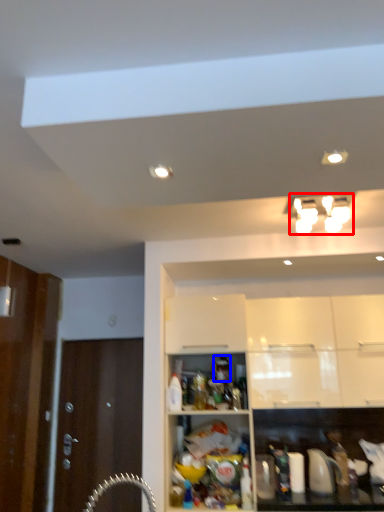
Question: Among these objects, which one is farthest to the camera, light fixture (highlighted by a red box) or beverage (highlighted by a blue box)?

Choices:
 (A) light fixture
 (B) beverage

Answer: (B)